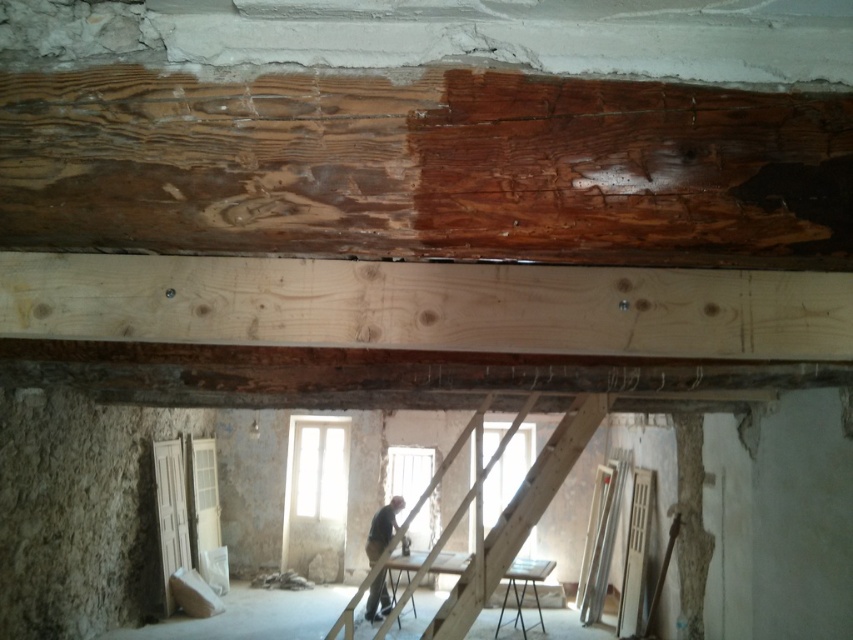
You are a contractor assessing the construction site. You notice the wooden at center and the dark gray fabric shirt at center. Which object takes up more space in the image?

The wooden at center has a larger size compared to the dark gray fabric shirt at center, so the wooden at center takes up more space in the image.

You are standing at the entrance of the room and want to locate the natural wood beam at center. According to the coordinates given, where should you look in the room?

The natural wood beam at center is located at coordinates point 0.263 on the x axis and 0.499 on the y axis.

You are standing at the point labeled point at (x=107, y=122). You want to walk to the other side of the room. The room is 1.45 meters wide. Can you walk straight ahead without turning?

The distance between the point labeled point at (x=107, y=122) and the other side of the room is 1.45 meters. Since the room is 1.45 meters wide, you can walk straight ahead without turning.